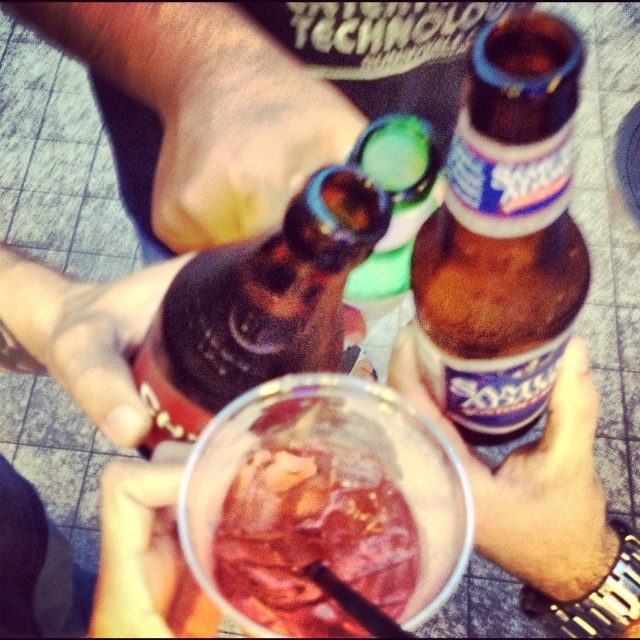
Question: Does translucent glass drink at center have a greater width compared to matte black hand at center?

Choices:
 (A) no
 (B) yes

Answer: (A)

Question: Which of the following is the farthest from the observer?

Choices:
 (A) translucent plastic cup at lower center
 (B) brown glass bottle at center
 (C) translucent glass drink at center
 (D) matte brown bottle at center

Answer: (D)

Question: Does brown glass bottle at center have a smaller size compared to matte black keychain at lower left?

Choices:
 (A) yes
 (B) no

Answer: (B)

Question: Which object is the closest to the brown glass bottle at center?

Choices:
 (A) matte brown bottle at center
 (B) translucent glass drink at center
 (C) translucent plastic cup at lower center

Answer: (C)

Question: Which object appears farthest from the camera in this image?

Choices:
 (A) matte black hand at center
 (B) translucent plastic cup at lower center
 (C) matte black keychain at lower left
 (D) green glass bottle at center

Answer: (A)

Question: Can you confirm if translucent glass drink at center is positioned to the left of matte black keychain at lower left?

Choices:
 (A) no
 (B) yes

Answer: (A)